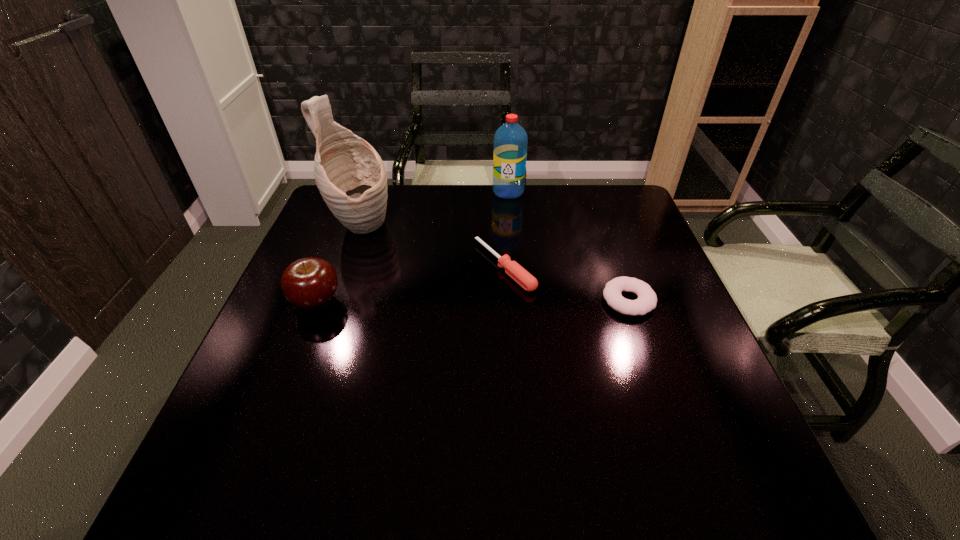
Image resolution: width=960 pixels, height=540 pixels. I want to click on pitcher that is at the left edge, so click(350, 175).

Locate an element on the screen. The width and height of the screenshot is (960, 540). object located at the right edge is located at coordinates (647, 299).

Locate an element on the screen. object present at the far left corner is located at coordinates (350, 175).

What are the coordinates of `vacant space at the far edge` in the screenshot? It's located at (548, 217).

In the image, there is a desktop. At what (x,y) coordinates should I click in order to perform the action: click on blank space at the near edge. Please return your answer as a coordinate pair (x, y). This screenshot has height=540, width=960. Looking at the image, I should click on (530, 427).

Where is `free region at the left edge of the desktop`? free region at the left edge of the desktop is located at coordinates (291, 379).

Find the location of a particular element. Image resolution: width=960 pixels, height=540 pixels. free space at the right edge of the desktop is located at coordinates (605, 267).

The height and width of the screenshot is (540, 960). Identify the location of vacant space at the far left corner of the desktop. (314, 224).

At what (x,y) coordinates should I click in order to perform the action: click on vacant area at the near left corner of the desktop. Please return your answer as a coordinate pair (x, y). Looking at the image, I should click on (235, 437).

The width and height of the screenshot is (960, 540). In the image, there is a desktop. In order to click on vacant space at the far right corner in this screenshot , I will do `click(617, 189)`.